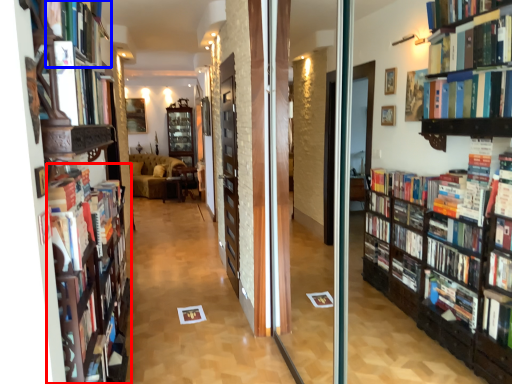
Question: Among these objects, which one is farthest to the camera, bookshelf (highlighted by a red box) or book (highlighted by a blue box)?

Choices:
 (A) bookshelf
 (B) book

Answer: (A)